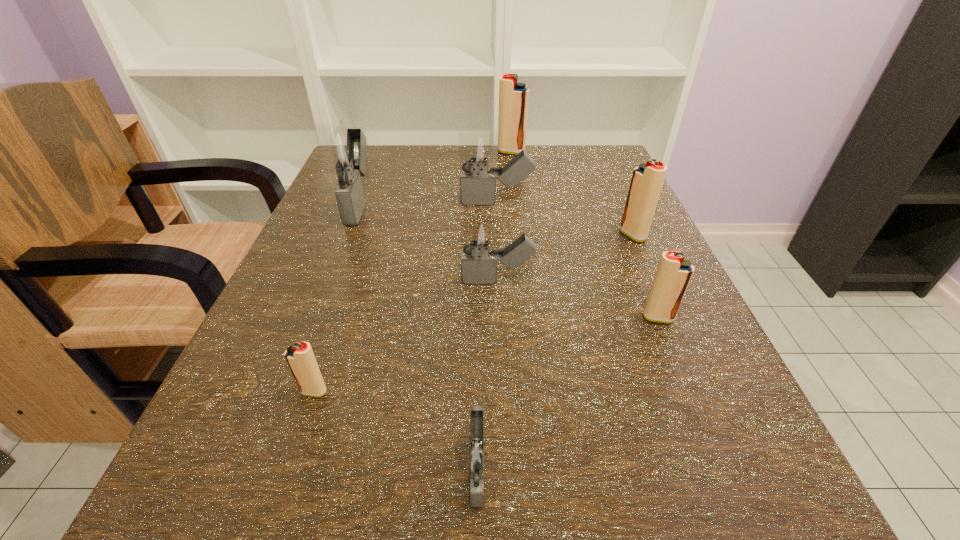
Where is `the second closest object to the sixth farthest igniter`? The width and height of the screenshot is (960, 540). the second closest object to the sixth farthest igniter is located at coordinates (647, 180).

Where is `igniter object that ranks as the third closest to the second biggest gray igniter`? Image resolution: width=960 pixels, height=540 pixels. igniter object that ranks as the third closest to the second biggest gray igniter is located at coordinates (478, 266).

The image size is (960, 540). I want to click on the fourth closest igniter relative to the fourth nearest object, so click(342, 150).

Select which red igniter is the third closest to the second nearest object. Please provide its 2D coordinates. Your answer should be formatted as a tuple, i.e. [(x, y)], where the tuple contains the x and y coordinates of a point satisfying the conditions above.

[(513, 96)]

What are the coordinates of `red igniter identified as the closest to the third biggest gray igniter` in the screenshot? It's located at (674, 272).

Identify which gray igniter is the nearest to the second smallest red igniter. Please provide its 2D coordinates. Your answer should be formatted as a tuple, i.e. [(x, y)], where the tuple contains the x and y coordinates of a point satisfying the conditions above.

[(478, 266)]

This screenshot has height=540, width=960. I want to click on gray igniter that can be found as the third closest to the second red igniter from left to right, so click(x=478, y=266).

Where is `free space in the image that satisfies the following two spatial constraints: 1. on the front side of the second smallest red igniter; 2. on the left side of the farthest igniter`? free space in the image that satisfies the following two spatial constraints: 1. on the front side of the second smallest red igniter; 2. on the left side of the farthest igniter is located at coordinates (531, 318).

Locate an element on the screen. The width and height of the screenshot is (960, 540). vacant space that satisfies the following two spatial constraints: 1. on the back side of the biggest red igniter; 2. on the left side of the fourth nearest object is located at coordinates (492, 152).